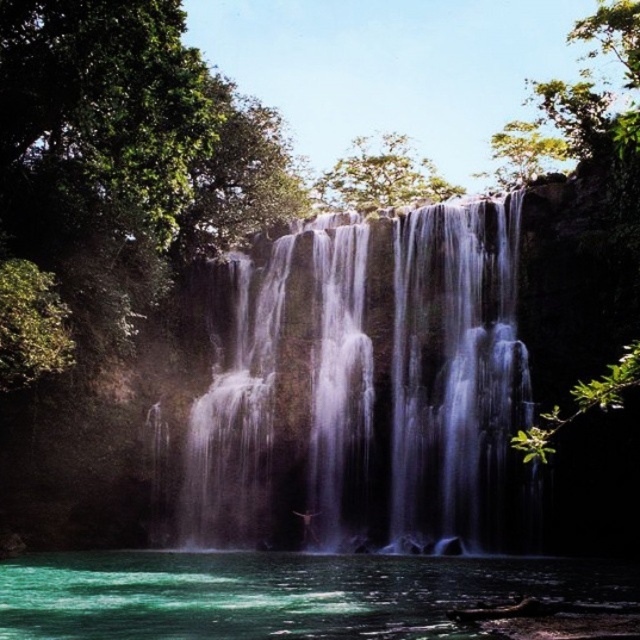
Question: Which of the following is the farthest from the observer?

Choices:
 (A) (378, 156)
 (B) (202, 428)
 (C) (100, 592)
 (D) (632, 372)

Answer: (A)

Question: Estimate the real-world distances between objects in this image. Which object is closer to the white silky waterfall at center?

Choices:
 (A) green translucent water at lower center
 (B) green leafy tree at upper center
 (C) green leafy tree at upper right

Answer: (A)

Question: Which is farther from the green leafy tree at upper right?

Choices:
 (A) green translucent water at lower center
 (B) green leafy tree at upper center
 (C) white silky waterfall at center

Answer: (B)

Question: Is green leafy tree at upper right thinner than green leafy tree at upper center?

Choices:
 (A) yes
 (B) no

Answer: (B)

Question: Does white silky waterfall at center appear on the right side of green translucent water at lower center?

Choices:
 (A) yes
 (B) no

Answer: (A)

Question: Is white silky waterfall at center in front of green translucent water at lower center?

Choices:
 (A) no
 (B) yes

Answer: (A)